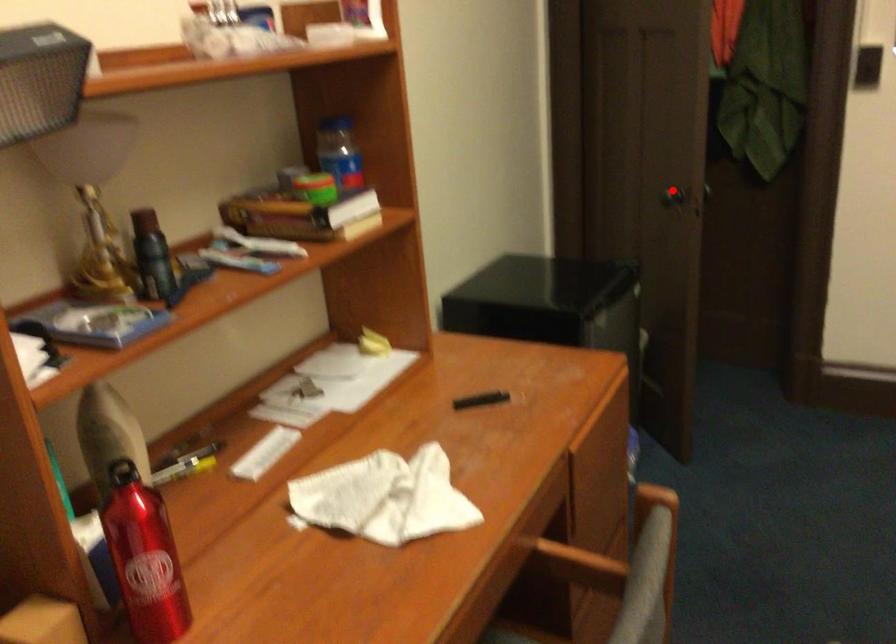
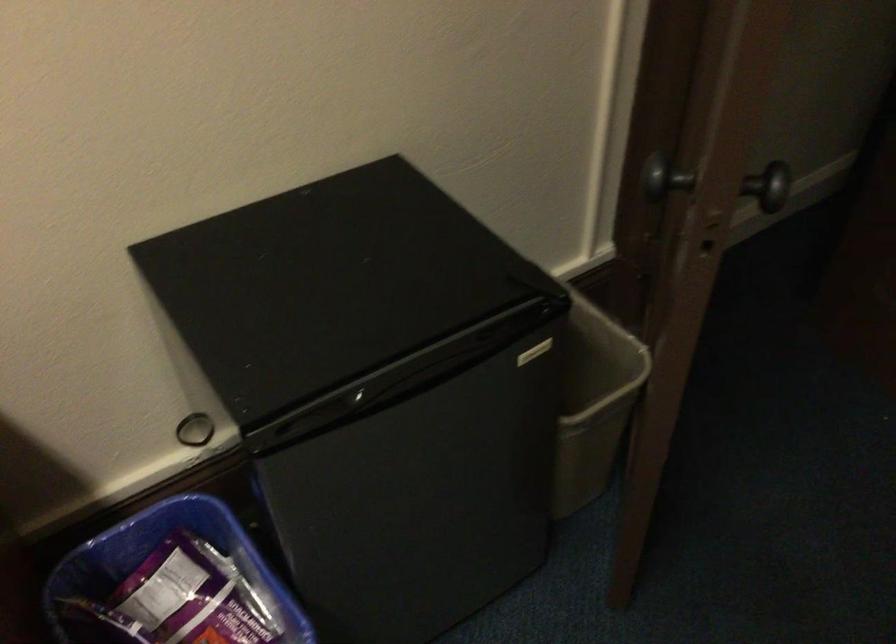
Locate, in the second image, the point that corresponds to the highlighted location in the first image.

(656, 174)